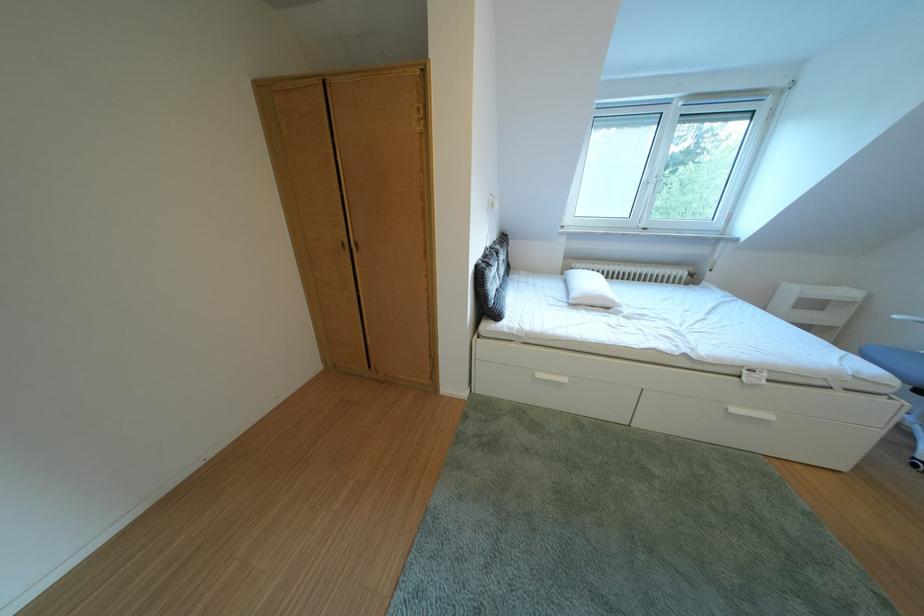
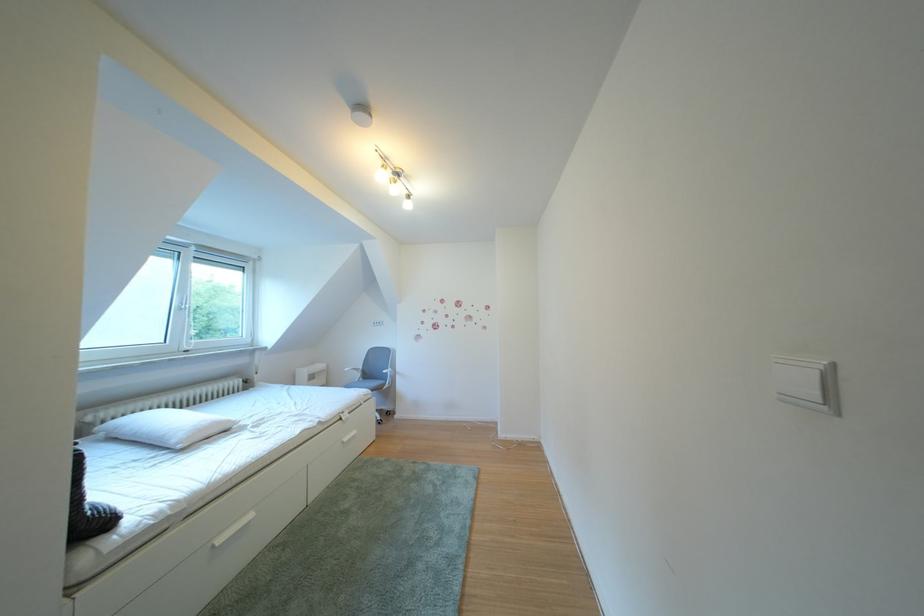
Question: Based on the continuous images, in which direction is the camera rotating? Reply with the corresponding letter.

Choices:
 (A) Left
 (B) Right
 (C) Up
 (D) Down

Answer: (B)